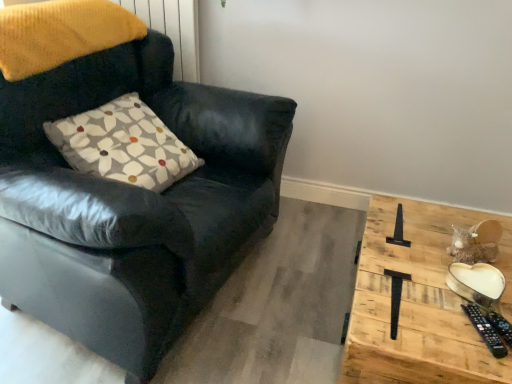
The width and height of the screenshot is (512, 384). What are the coordinates of `free spot above wooden heart-shaped plate at right (from a real-world perspective)` in the screenshot? It's located at (428, 276).